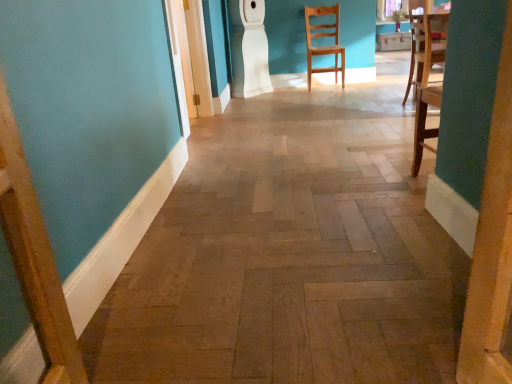
Question: Should I look upward or downward to see light brown wood chair at upper right?

Choices:
 (A) up
 (B) down

Answer: (A)